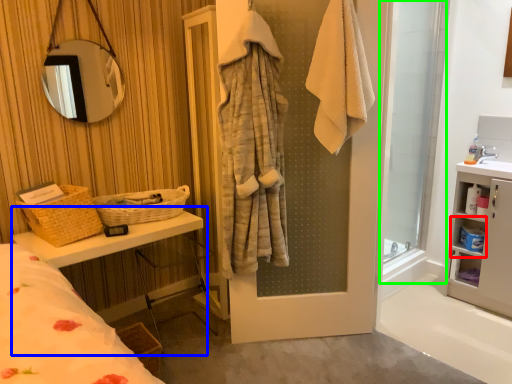
Question: Considering the real-world distances, which object is closest to cabinet (highlighted by a red box)? vanity (highlighted by a blue box) or screen door (highlighted by a green box).

Choices:
 (A) vanity
 (B) screen door

Answer: (B)